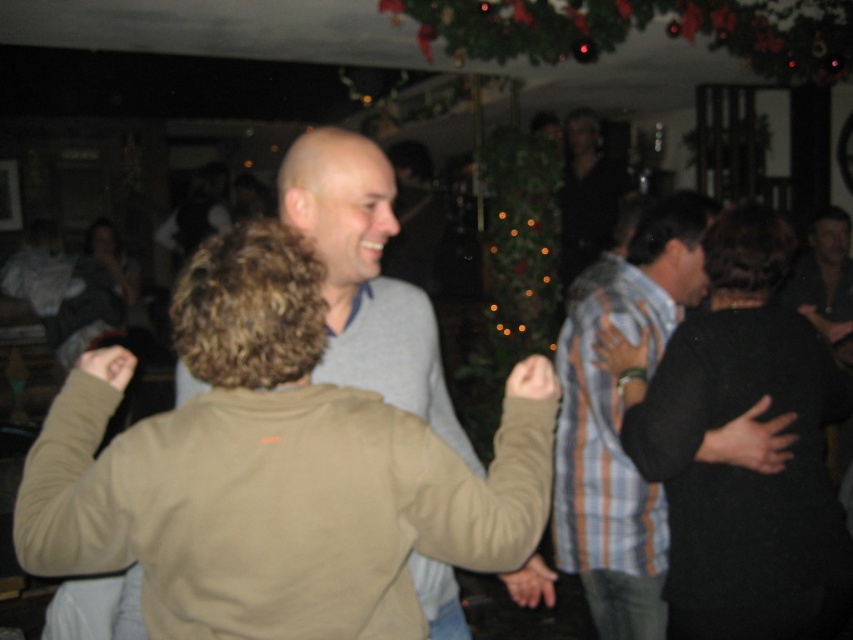
The height and width of the screenshot is (640, 853). What are the coordinates of `black matte dress at center` in the screenshot? It's located at (735, 467).

Based on the photo, does black matte dress at center have a lesser width compared to striped cotton shirt at right?

In fact, black matte dress at center might be wider than striped cotton shirt at right.

Locate an element on the screen. Image resolution: width=853 pixels, height=640 pixels. black matte dress at center is located at coordinates (735, 467).

Find the location of a particular element. black matte dress at center is located at coordinates (735, 467).

From the picture: Between striped cotton shirt at right and gray matte sweater at center, which one has less height?

gray matte sweater at center

Who is taller, striped cotton shirt at right or gray matte sweater at center?

striped cotton shirt at right is taller.

I want to click on striped cotton shirt at right, so click(619, 422).

Find the location of a particular element. The image size is (853, 640). striped cotton shirt at right is located at coordinates (619, 422).

Does black matte dress at center have a smaller size compared to gray matte sweater at center?

Yes, black matte dress at center is smaller than gray matte sweater at center.

Who is more distant from viewer, (694, 579) or (410, 316)?

The point (694, 579) is more distant.

Which is in front, point (781, 627) or point (387, 365)?

Positioned in front is point (387, 365).

At what (x,y) coordinates should I click in order to perform the action: click on black matte dress at center. Please return your answer as a coordinate pair (x, y). The image size is (853, 640). Looking at the image, I should click on (735, 467).